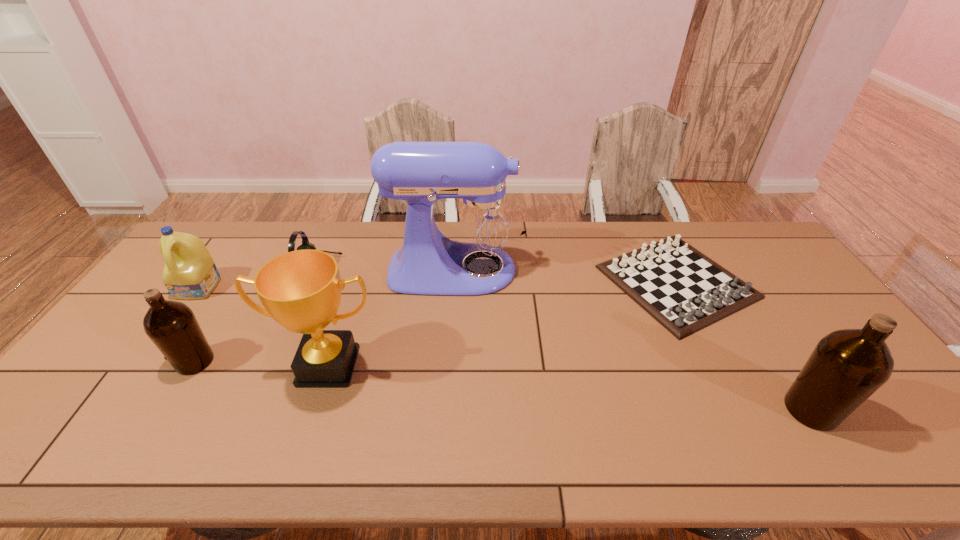
If equal spacing is desired by inserting an extra olive_oil among them, please point out a free spot for this new olive_oil. Please provide its 2D coordinates. Your answer should be formatted as a tuple, i.e. [(x, y)], where the tuple contains the x and y coordinates of a point satisfying the conditions above.

[(488, 384)]